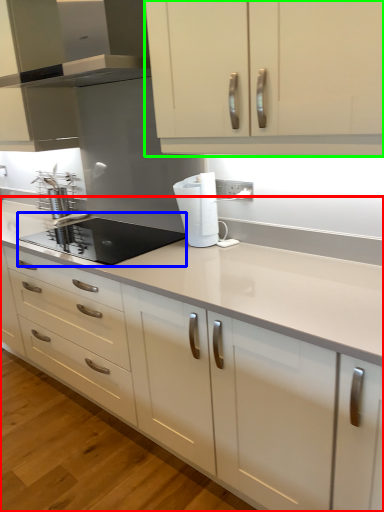
Question: Which is farther away from countertop (highlighted by a red box)? kitchen appliance (highlighted by a blue box) or cabinetry (highlighted by a green box)?

Choices:
 (A) kitchen appliance
 (B) cabinetry

Answer: (B)